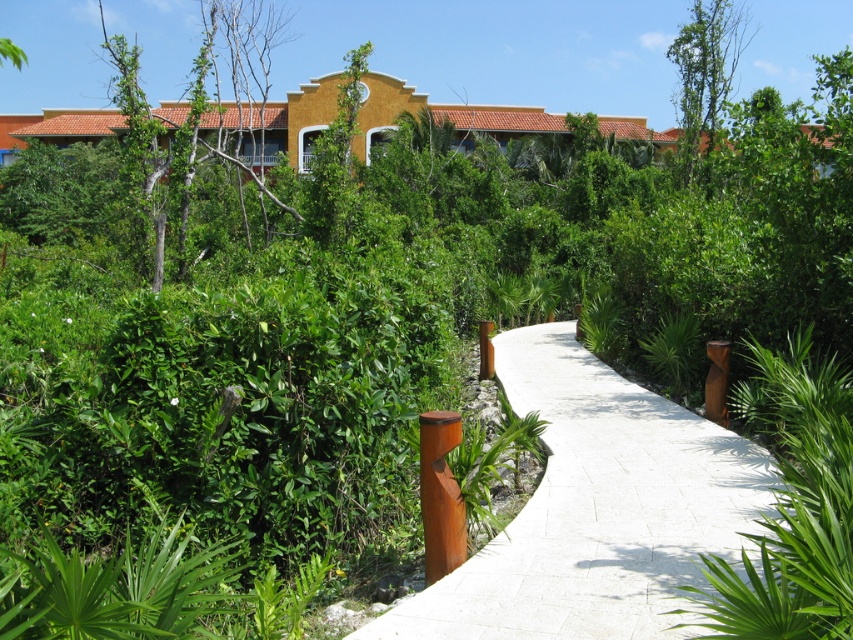
Does white concrete pavement at center appear under green leafy tree at upper right?

Yes.

Between point (531, 371) and point (691, 172), which one is positioned behind?

Positioned behind is point (691, 172).

Between point (505, 344) and point (746, 20), which one is positioned in front?

Point (505, 344) is more forward.

I want to click on white concrete pavement at center, so click(x=596, y=509).

Does green leafy tree at upper left have a larger size compared to green leafy tree at upper right?

Yes.

Does green leafy tree at upper left appear on the right side of green leafy tree at upper right?

No, green leafy tree at upper left is not to the right of green leafy tree at upper right.

Is point (224, 17) positioned before point (706, 141)?

Yes, point (224, 17) is in front of point (706, 141).

The width and height of the screenshot is (853, 640). I want to click on green leafy tree at upper left, so click(221, 100).

Does green leafy tree at upper left lie in front of bare wood tree at upper center?

That is False.

Can you confirm if green leafy tree at upper left is positioned above bare wood tree at upper center?

Yes.

The image size is (853, 640). Describe the element at coordinates (221, 100) in the screenshot. I see `green leafy tree at upper left` at that location.

At what (x,y) coordinates should I click in order to perform the action: click on green leafy tree at upper left. Please return your answer as a coordinate pair (x, y). Looking at the image, I should click on (221, 100).